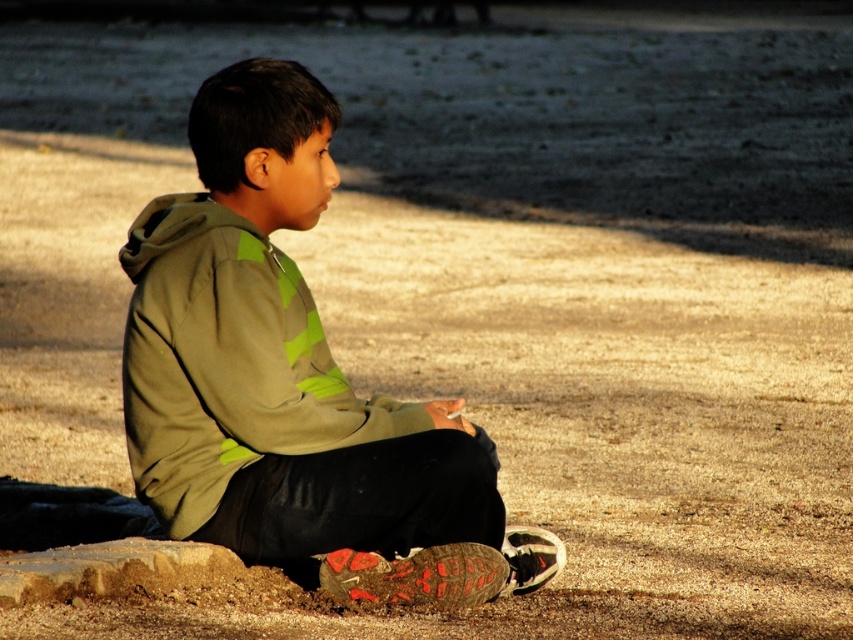
Question: Which object is positioned closest to the smooth brown rock at lower left?

Choices:
 (A) olive-green fleece jacket at center
 (B) green matte hoodie at center

Answer: (A)

Question: Is green matte hoodie at center in front of olive-green fleece jacket at center?

Choices:
 (A) no
 (B) yes

Answer: (A)

Question: Which is farther from the green matte hoodie at center?

Choices:
 (A) smooth brown rock at lower left
 (B) olive-green fleece jacket at center

Answer: (A)

Question: Which object is farther from the camera taking this photo?

Choices:
 (A) green matte hoodie at center
 (B) smooth brown rock at lower left

Answer: (A)

Question: From the image, what is the correct spatial relationship of olive-green fleece jacket at center in relation to smooth brown rock at lower left?

Choices:
 (A) left
 (B) right

Answer: (B)

Question: Does green matte hoodie at center appear under smooth brown rock at lower left?

Choices:
 (A) no
 (B) yes

Answer: (A)